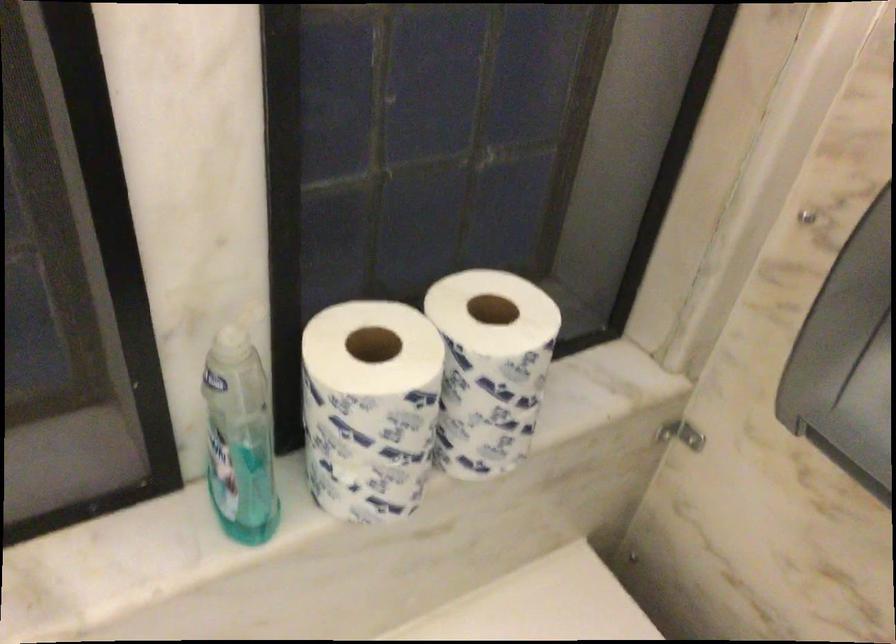
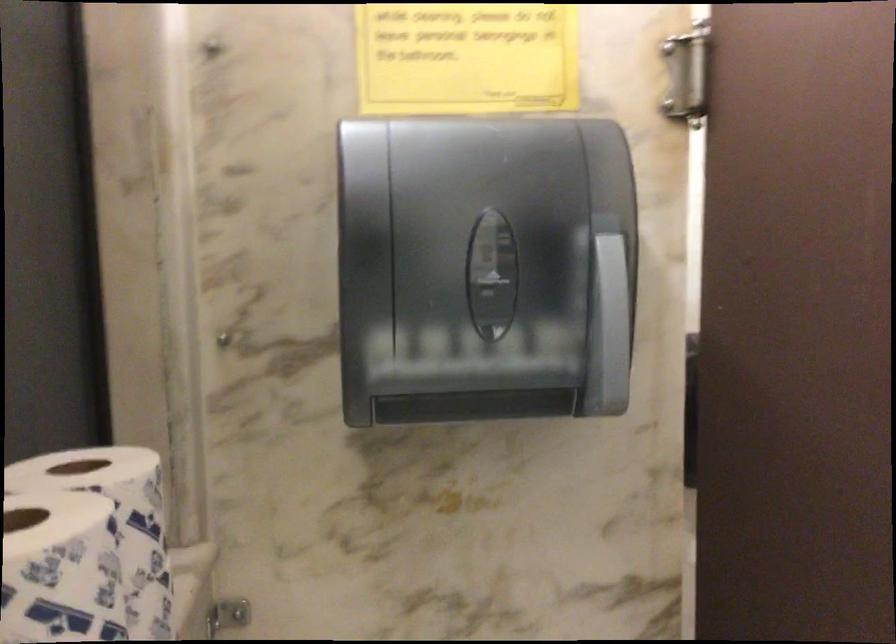
Question: The camera is either moving clockwise (left) or counter-clockwise (right) around the object. The first image is from the beginning of the video and the second image is from the end. Is the camera moving left or right when shooting the video?

Choices:
 (A) Left
 (B) Right

Answer: (A)